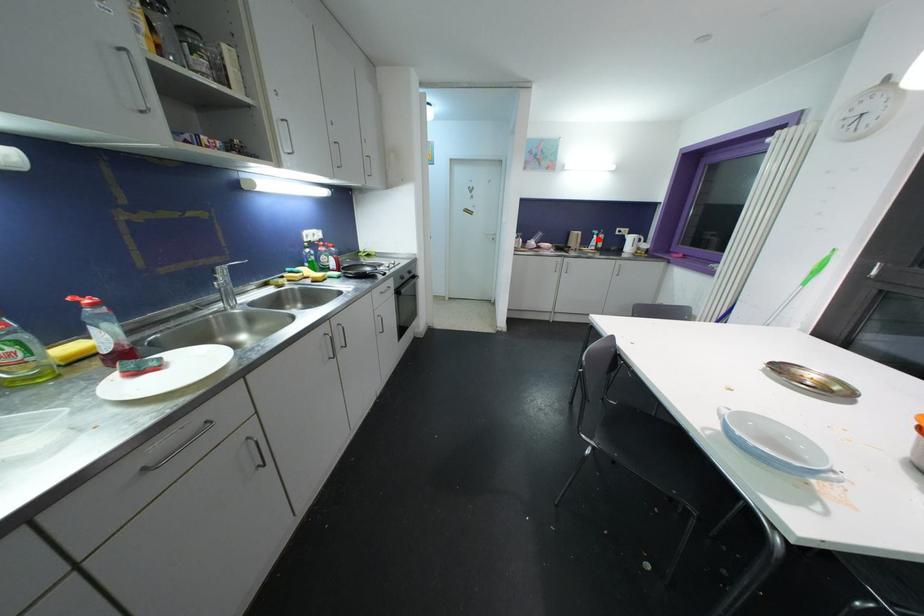
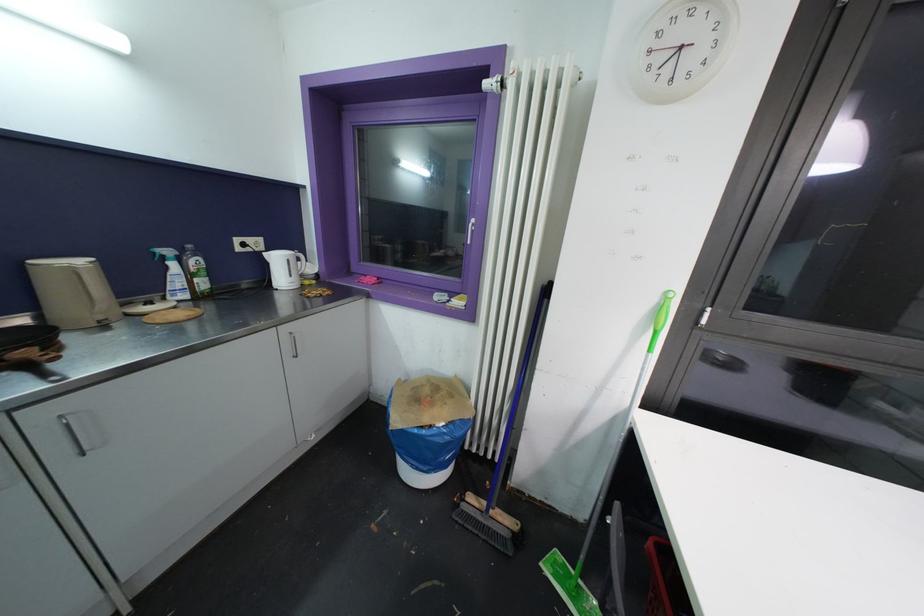
Locate, in the second image, the point that corresponds to the highlighted location in the first image.

(176, 267)